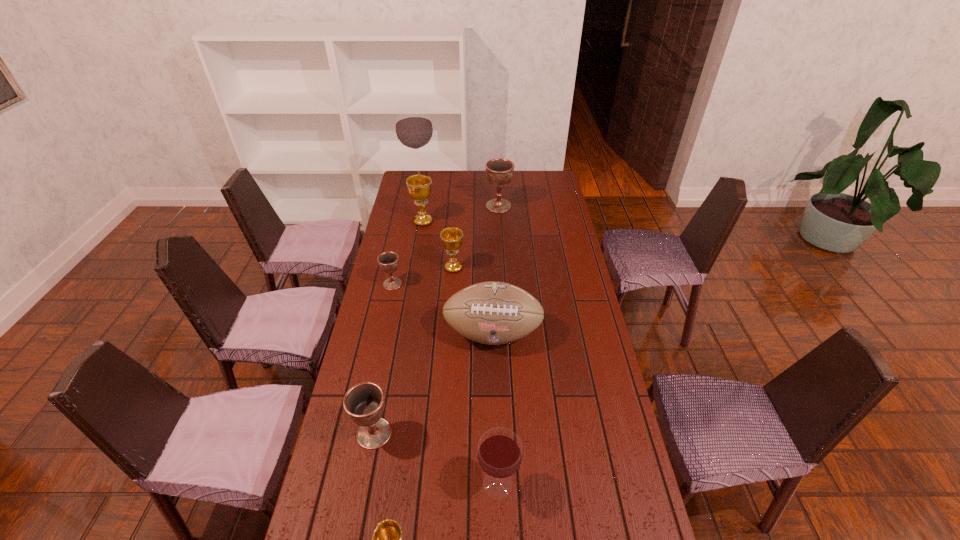
Find the location of a particular element. The width and height of the screenshot is (960, 540). the fourth farthest object is located at coordinates (451, 237).

Where is `the second smallest brown chalice`? The height and width of the screenshot is (540, 960). the second smallest brown chalice is located at coordinates (364, 403).

What are the coordinates of `the fifth farthest chalice` in the screenshot? It's located at (364, 403).

I want to click on the smallest brown chalice, so click(388, 262).

This screenshot has height=540, width=960. I want to click on the second farthest brown chalice, so click(x=388, y=262).

Find the location of a particular element. The width and height of the screenshot is (960, 540). vacant space located 0.190m on the right of the red alcohol is located at coordinates (472, 181).

Find the location of a particular element. The height and width of the screenshot is (540, 960). free location located 0.190m on the front of the farthest chalice is located at coordinates (500, 237).

The height and width of the screenshot is (540, 960). In order to click on vacant space situated 0.300m on the right of the seventh nearest object in this screenshot , I will do `click(498, 222)`.

The width and height of the screenshot is (960, 540). What are the coordinates of `vacant space located on the laces of the football (American)` in the screenshot? It's located at (493, 372).

Where is `free space located 0.360m on the left of the eighth farthest object`? free space located 0.360m on the left of the eighth farthest object is located at coordinates (344, 483).